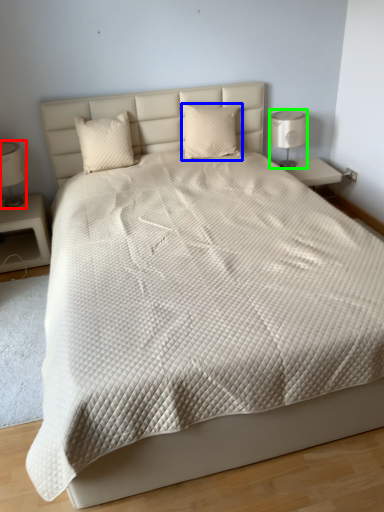
Question: Which object is positioned farthest from bedside lamp (highlighted by a red box)? Select from pillow (highlighted by a blue box) and bedside lamp (highlighted by a green box).

Choices:
 (A) pillow
 (B) bedside lamp

Answer: (B)